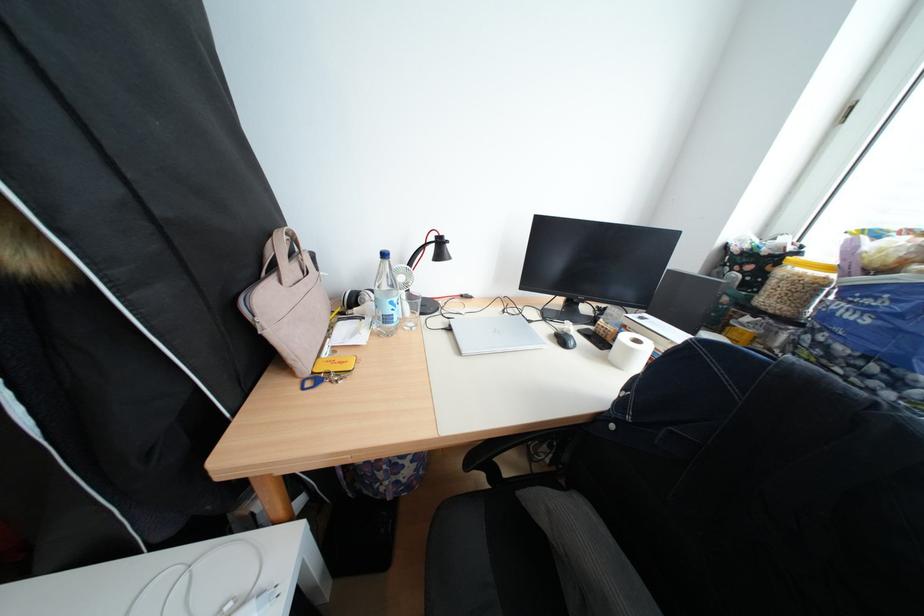
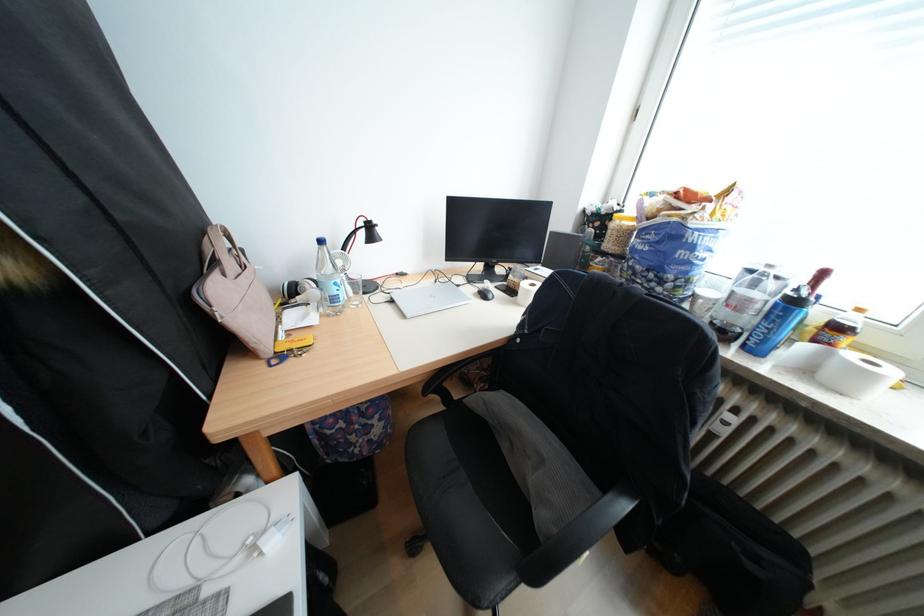
In the second image, find the point that corresponds to (381,321) in the first image.

(325, 306)